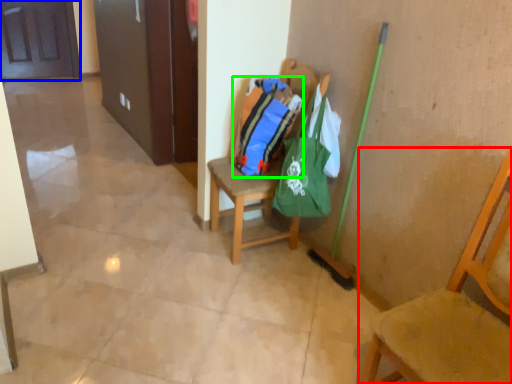
Question: Which object is positioned farthest from chair (highlighted by a red box)? Select from door (highlighted by a blue box) and bag (highlighted by a green box).

Choices:
 (A) door
 (B) bag

Answer: (A)